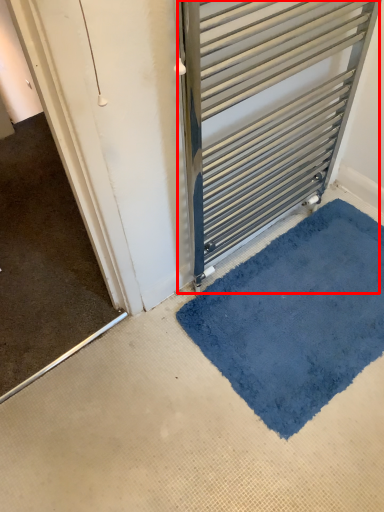
Question: From the image's perspective, what is the correct spatial relationship of door (annotated by the red box) in relation to bath mat?

Choices:
 (A) above
 (B) below

Answer: (A)